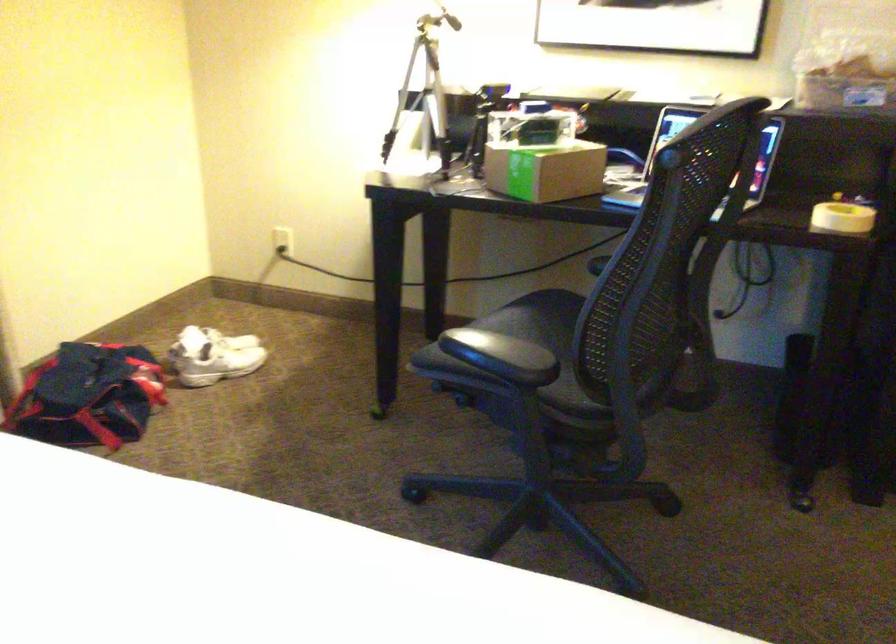
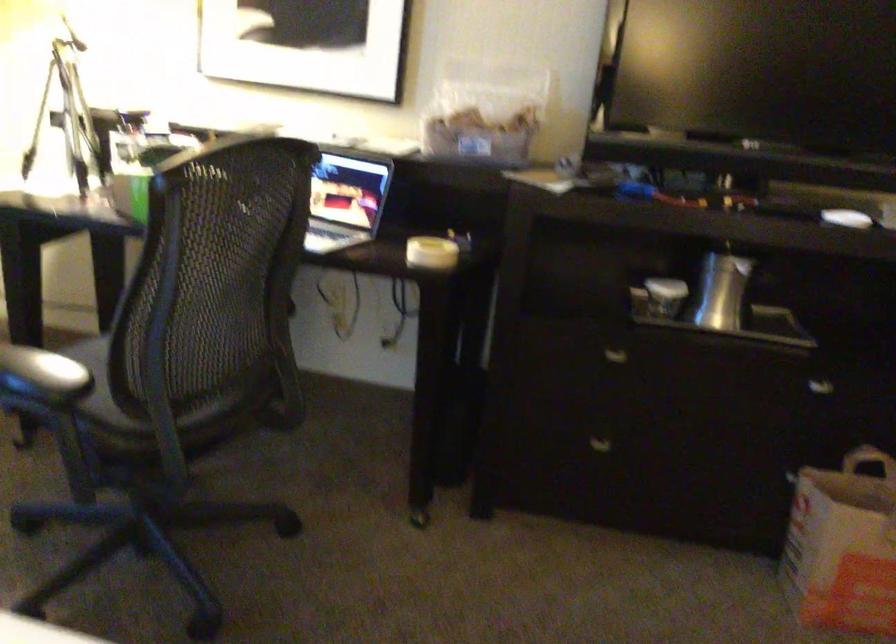
In the second image, find the point that corresponds to [586,325] in the first image.

(124, 346)